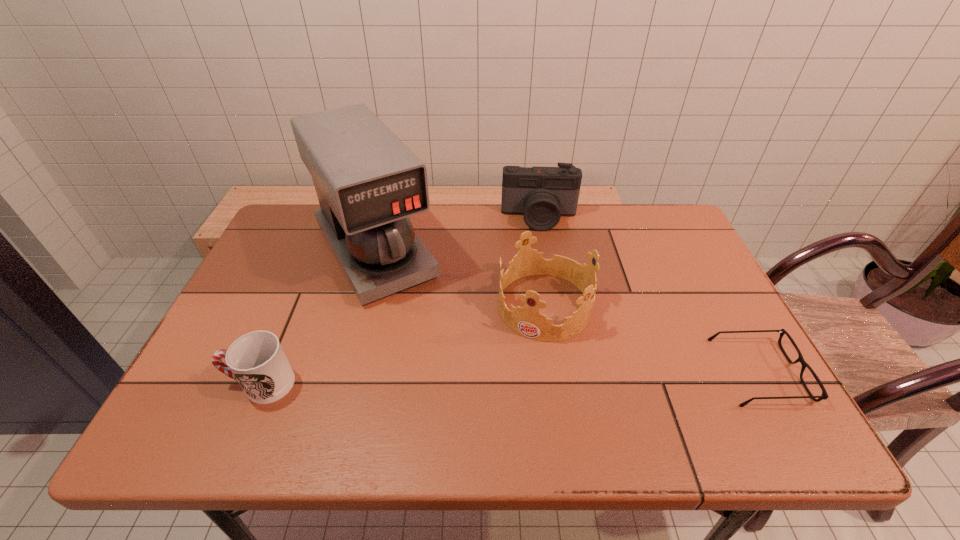
Identify the location of empty location between the cup and the tallest object. Image resolution: width=960 pixels, height=540 pixels. (318, 317).

Locate an element on the screen. The height and width of the screenshot is (540, 960). free space that is in between the tallest object and the tiara is located at coordinates (x=460, y=278).

Locate an element on the screen. This screenshot has width=960, height=540. free point between the tiara and the coffee maker is located at coordinates (460, 278).

Identify the location of free space between the coffee maker and the camera. (457, 234).

Locate an element on the screen. The width and height of the screenshot is (960, 540). free space between the fourth tallest object and the camera is located at coordinates (400, 301).

Locate an element on the screen. vacant region between the tiara and the coffee maker is located at coordinates (460, 278).

Where is `free spot between the shortest object and the coffee maker`? Image resolution: width=960 pixels, height=540 pixels. free spot between the shortest object and the coffee maker is located at coordinates (567, 311).

Where is `the closest object to the cup`? The width and height of the screenshot is (960, 540). the closest object to the cup is located at coordinates (368, 182).

Identify which object is the fourth closest to the cup. Please provide its 2D coordinates. Your answer should be formatted as a tuple, i.e. [(x, y)], where the tuple contains the x and y coordinates of a point satisfying the conditions above.

[(824, 396)]

Where is `vacant space that satisfies the following two spatial constraints: 1. on the front side of the rightmost object; 2. on the front-facing side of the camera`? vacant space that satisfies the following two spatial constraints: 1. on the front side of the rightmost object; 2. on the front-facing side of the camera is located at coordinates (565, 372).